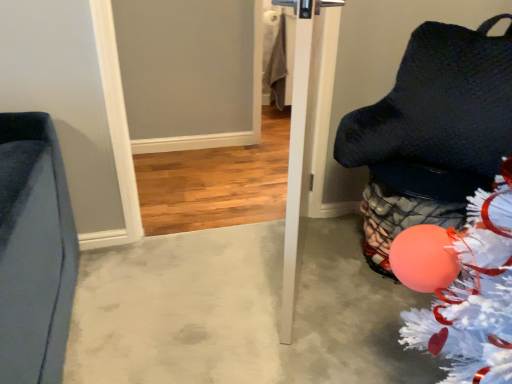
I want to click on free point in front of white smooth door at center, so click(x=294, y=337).